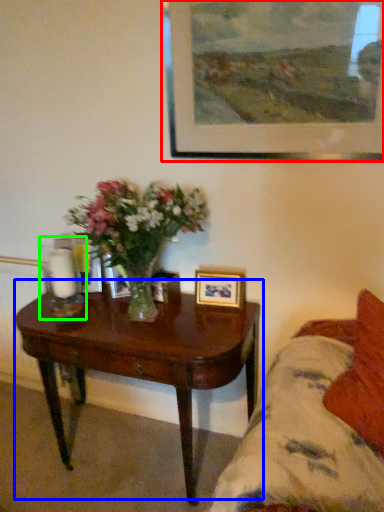
Question: Which is nearer to the picture frame (highlighted by a red box)? coffee table (highlighted by a blue box) or candle holder (highlighted by a green box).

Choices:
 (A) coffee table
 (B) candle holder

Answer: (A)